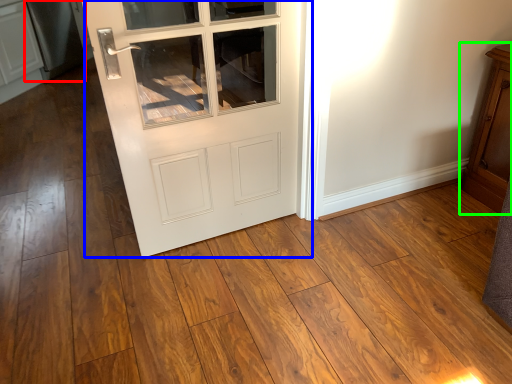
Question: Which is nearer to the appliance (highlighted by a red box)? door (highlighted by a blue box) or dresser (highlighted by a green box).

Choices:
 (A) door
 (B) dresser

Answer: (A)